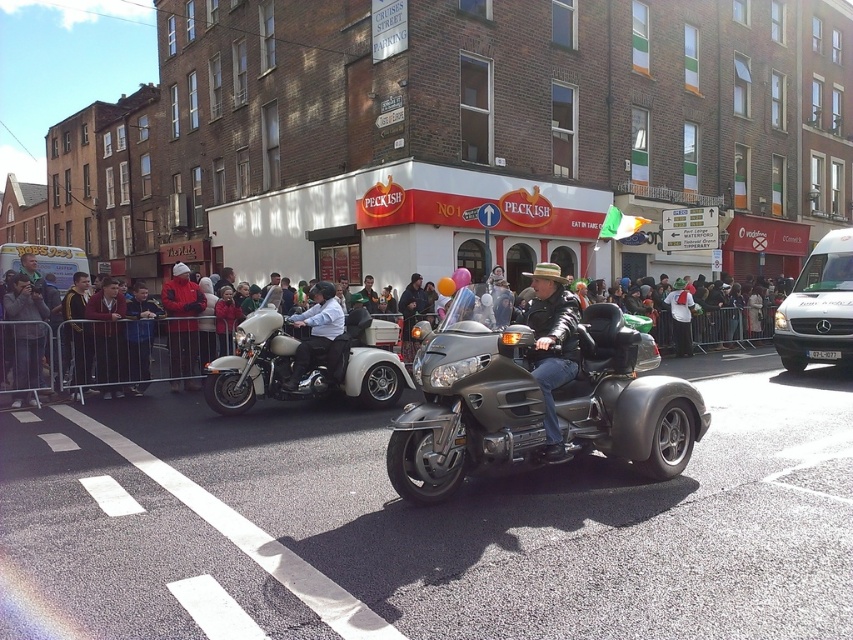
Question: Estimate the real-world distances between objects in this image. Which object is closer to the metallic trike at center?

Choices:
 (A) white matte trike at center
 (B) matte black motorcycle at center

Answer: (A)

Question: Is metallic trike at center above multicolored fabric crowd at center?

Choices:
 (A) no
 (B) yes

Answer: (A)

Question: Which point is farther from the camera taking this photo?

Choices:
 (A) click(x=177, y=385)
 (B) click(x=578, y=438)
 (C) click(x=759, y=320)
 (D) click(x=347, y=376)

Answer: (C)

Question: Does multicolored fabric crowd at center have a lesser width compared to red jacket at center?

Choices:
 (A) no
 (B) yes

Answer: (A)

Question: Can you confirm if multicolored fabric crowd at center is positioned below red jacket at center?

Choices:
 (A) yes
 (B) no

Answer: (A)

Question: Which point is closer to the camera taking this photo?

Choices:
 (A) (276, 362)
 (B) (9, 369)

Answer: (A)